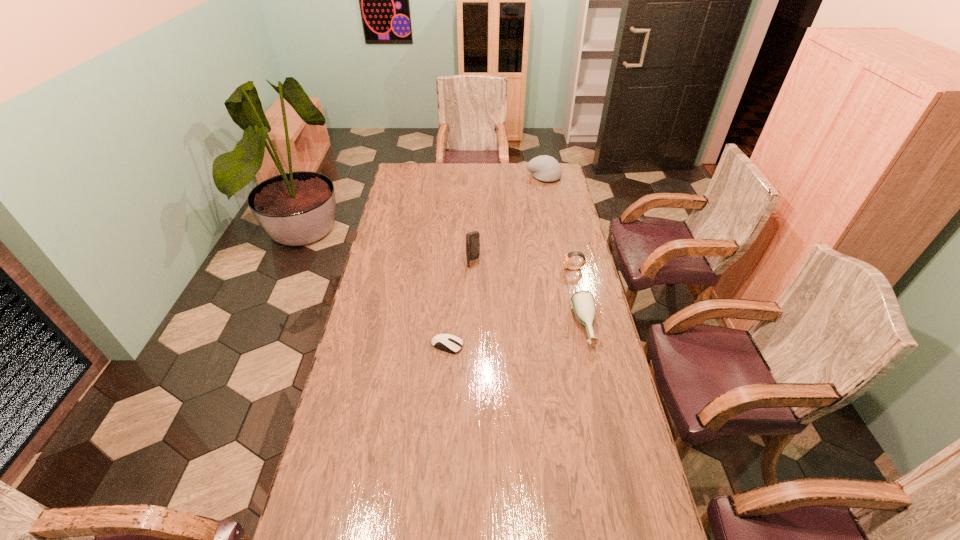
In order to click on blank area located 0.180m on the face of the watch in this screenshot , I will do `click(520, 269)`.

The image size is (960, 540). What are the coordinates of `vacant area situated on the face of the watch` in the screenshot? It's located at (542, 269).

This screenshot has width=960, height=540. I want to click on free space located 0.360m on the face of the watch, so click(478, 269).

The width and height of the screenshot is (960, 540). In order to click on vacant space located 0.120m on the left of the bottle in this screenshot , I will do `click(540, 327)`.

Find the location of a particular element. Image resolution: width=960 pixels, height=540 pixels. free space located on the back of the shortest object is located at coordinates (452, 265).

Find the location of `object that is at the far edge`. object that is at the far edge is located at coordinates (545, 168).

At what (x,y) coordinates should I click in order to perform the action: click on beanie that is at the right edge. Please return your answer as a coordinate pair (x, y). This screenshot has height=540, width=960. Looking at the image, I should click on (545, 168).

I want to click on watch that is at the right edge, so pos(566,258).

This screenshot has height=540, width=960. I want to click on bottle located at the right edge, so click(x=583, y=303).

The height and width of the screenshot is (540, 960). I want to click on object located in the far right corner section of the desktop, so click(545, 168).